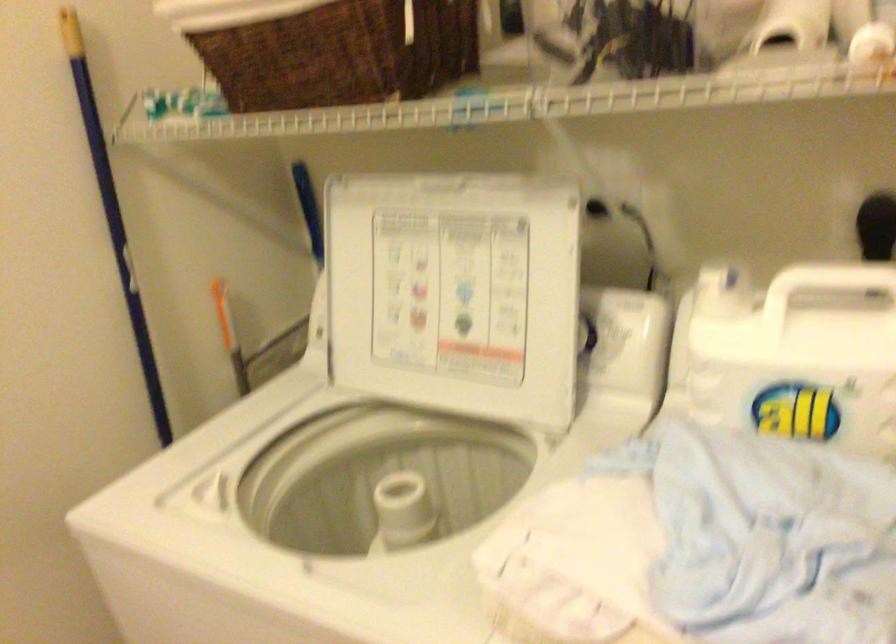
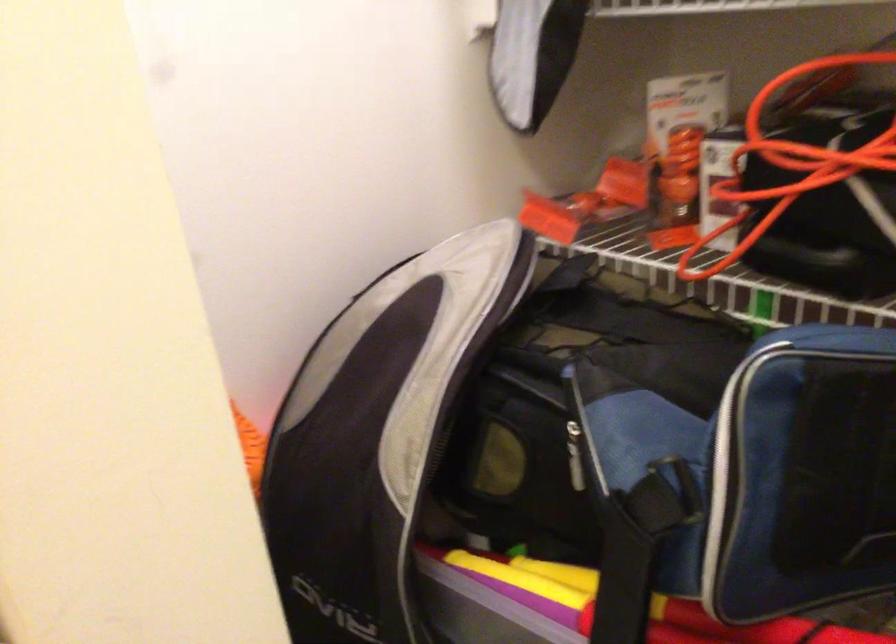
Question: The camera is either moving clockwise (left) or counter-clockwise (right) around the object. The first image is from the beginning of the video and the second image is from the end. Is the camera moving left or right when shooting the video?

Choices:
 (A) Left
 (B) Right

Answer: (A)